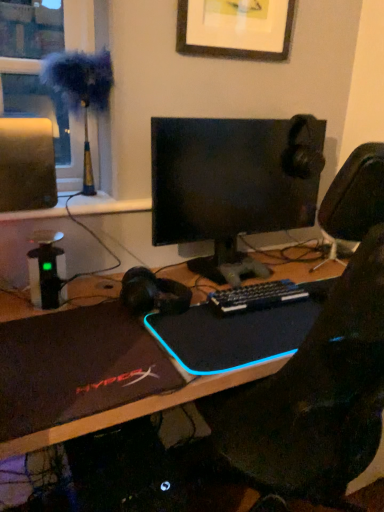
At what (x,y) coordinates should I click in order to perform the action: click on vacant space underneath black glossy monitor at center (from a real-world perspective). Please return your answer as a coordinate pair (x, y). Looking at the image, I should click on (214, 274).